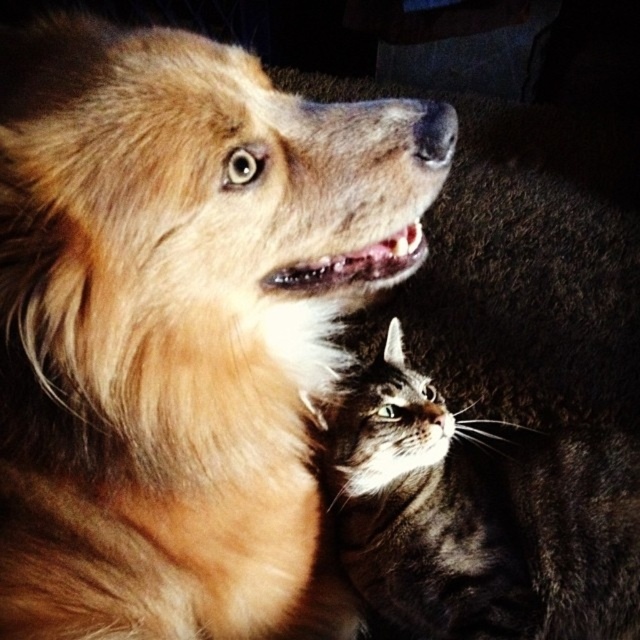
You are a photographer trying to capture both the golden fur dog at upper left and the tabby fur cat at center in a single frame. Which animal should you focus on first to ensure both fit in the shot?

The golden fur dog at upper left is wider than the tabby fur cat at center, so you should focus on the golden fur dog at upper left first to ensure both fit in the shot.

You are a photographer setting up a photo shoot for a pet magazine. You need to position the golden fur dog at upper left and the tabby fur cat at center in a way that both fit comfortably within the frame. Considering their sizes, which animal should you give more space to in the composition?

The golden fur dog at upper left is larger than the tabby fur cat at center, so you should give more space to the golden fur dog at upper left in the composition to accommodate its size.